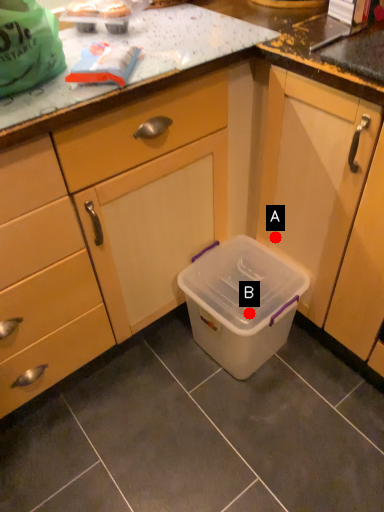
Question: Two points are circled on the image, labeled by A and B beside each circle. Which point appears closest to the camera in this image?

Choices:
 (A) A is closer
 (B) B is closer

Answer: (B)